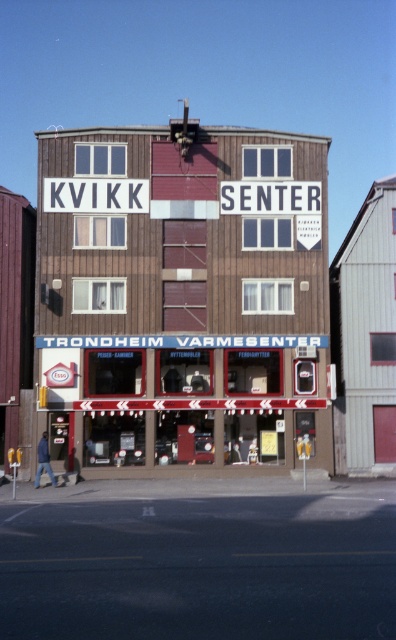
You are standing in front of the two story commercial building. You want to locate the brown wood paneling at center. Where exactly is it located?

The brown wood paneling at center is located at point (182, 294).